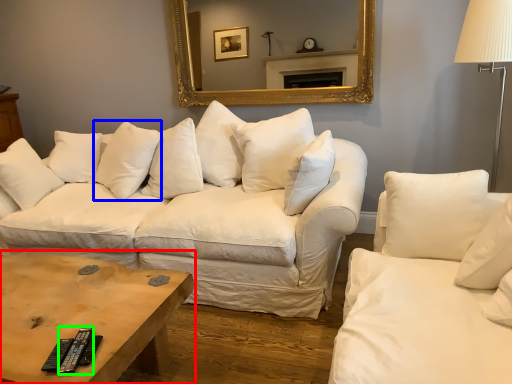
Question: Which object is the farthest from coffee table (highlighted by a red box)? Choose among these: pillow (highlighted by a blue box) or remote (highlighted by a green box).

Choices:
 (A) pillow
 (B) remote

Answer: (A)